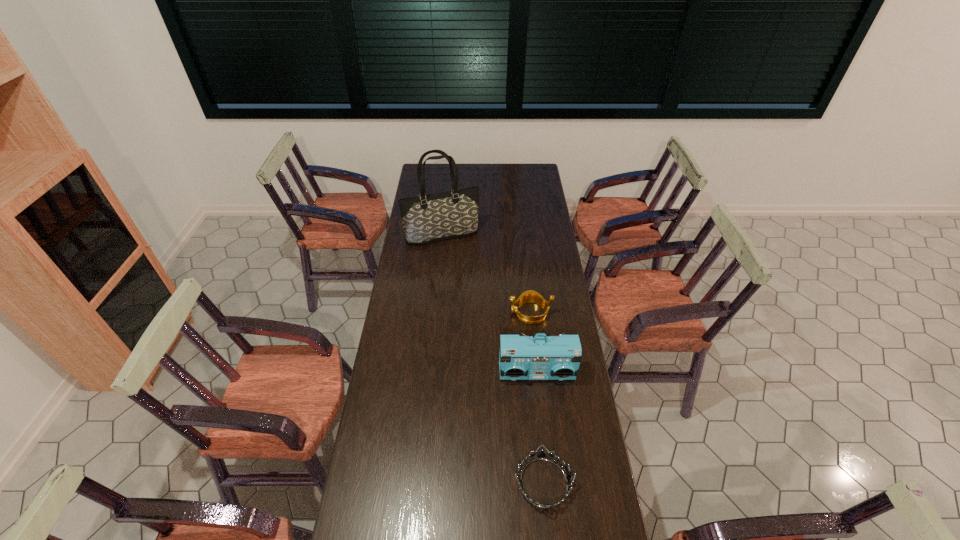
Locate an element on the screen. the leftmost object is located at coordinates (429, 218).

The height and width of the screenshot is (540, 960). Identify the location of tote bag. (429, 218).

Identify the location of radio receiver. (520, 357).

The width and height of the screenshot is (960, 540). In order to click on the second nearest object in this screenshot , I will do `click(520, 357)`.

This screenshot has height=540, width=960. What are the coordinates of `the third tallest object` in the screenshot? It's located at (530, 296).

Locate an element on the screen. The height and width of the screenshot is (540, 960). the second farthest object is located at coordinates (530, 296).

Where is `the nearest object`? The height and width of the screenshot is (540, 960). the nearest object is located at coordinates (541, 455).

Locate an element on the screen. Image resolution: width=960 pixels, height=540 pixels. the shortest object is located at coordinates (541, 455).

Image resolution: width=960 pixels, height=540 pixels. Find the location of `free spot located on the front of the tote bag`. free spot located on the front of the tote bag is located at coordinates point(439,273).

This screenshot has width=960, height=540. Find the location of `vacant space located 0.070m on the front-facing side of the second nearest object`. vacant space located 0.070m on the front-facing side of the second nearest object is located at coordinates coord(540,402).